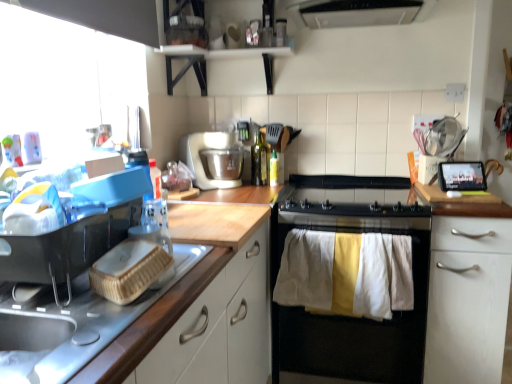
Question: Does white plastic mixer at center have a greater height compared to black matte stove at center?

Choices:
 (A) no
 (B) yes

Answer: (A)

Question: Would you say black matte stove at center is part of white plastic mixer at center's contents?

Choices:
 (A) no
 (B) yes

Answer: (A)

Question: Does white plastic mixer at center have a lesser height compared to black matte stove at center?

Choices:
 (A) no
 (B) yes

Answer: (B)

Question: Does white plastic mixer at center come behind black matte stove at center?

Choices:
 (A) no
 (B) yes

Answer: (B)

Question: Is white plastic mixer at center not within black matte stove at center?

Choices:
 (A) yes
 (B) no

Answer: (A)

Question: Is green glass bottle at center, which is counted as the 1th bottle, starting from the left, in front of or behind wooden countertop at left, the second cabinetry when ordered from back to front, in the image?

Choices:
 (A) front
 (B) behind

Answer: (B)

Question: Based on their positions, is green glass bottle at center, which is counted as the 1th bottle, starting from the left, located to the left or right of wooden countertop at left, the second cabinetry when ordered from back to front?

Choices:
 (A) left
 (B) right

Answer: (B)

Question: Choose the correct answer: Is green glass bottle at center, positioned as the 2th bottle in right-to-left order, inside wooden countertop at left, the first cabinetry in the front-to-back sequence, or outside it?

Choices:
 (A) inside
 (B) outside

Answer: (B)

Question: Is green glass bottle at center, positioned as the 2th bottle in right-to-left order, taller or shorter than wooden countertop at left, the first cabinetry in the front-to-back sequence?

Choices:
 (A) short
 (B) tall

Answer: (B)

Question: In the image, is black matte stove at center on the left side or the right side of black glass gas stove at center?

Choices:
 (A) right
 (B) left

Answer: (A)

Question: Considering the positions of black matte stove at center and black glass gas stove at center in the image, is black matte stove at center wider or thinner than black glass gas stove at center?

Choices:
 (A) wide
 (B) thin

Answer: (B)

Question: Is black matte stove at center taller or shorter than black glass gas stove at center?

Choices:
 (A) tall
 (B) short

Answer: (A)

Question: Is point (315, 347) positioned closer to the camera than point (340, 220)?

Choices:
 (A) closer
 (B) farther

Answer: (B)

Question: Based on their sizes in the image, would you say black glass gas stove at center is bigger or smaller than green glass bottle at center, positioned as the 2th bottle in right-to-left order?

Choices:
 (A) big
 (B) small

Answer: (A)

Question: Based on their positions, is black glass gas stove at center located to the left or right of green glass bottle at center, which is counted as the 1th bottle, starting from the left?

Choices:
 (A) left
 (B) right

Answer: (B)